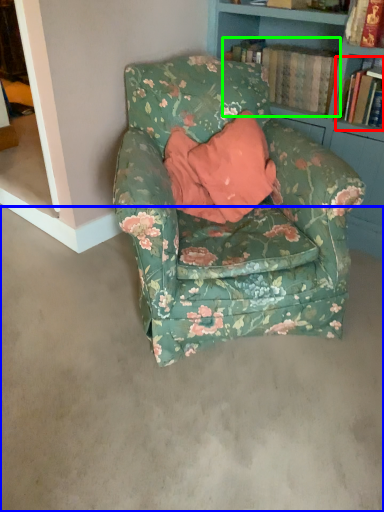
Question: Estimate the real-world distances between objects in this image. Which object is closer to book (highlighted by a red box), concrete (highlighted by a blue box) or book (highlighted by a green box)?

Choices:
 (A) concrete
 (B) book

Answer: (B)